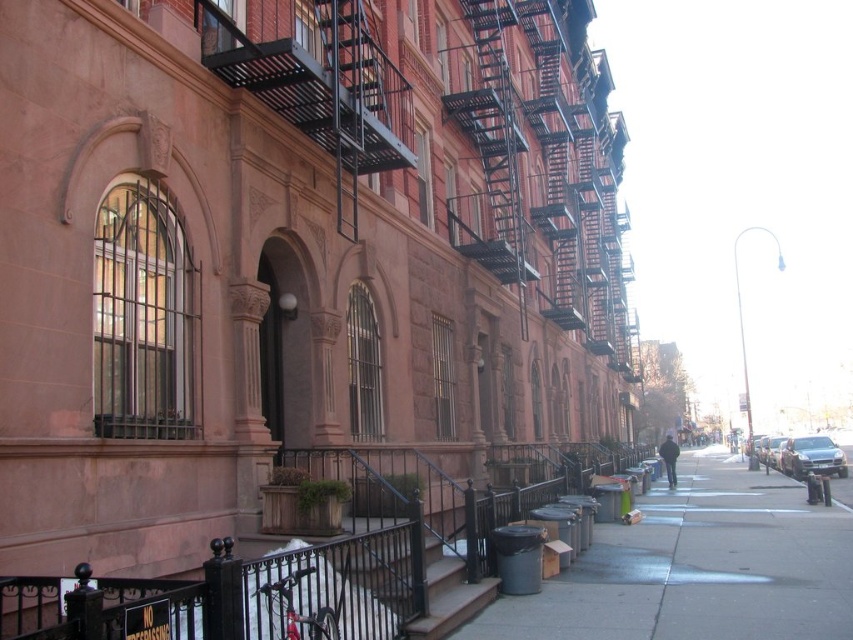
You are a delivery person with a 2.5 meter long box to deliver. You need to place it on the smooth concrete sidewalk at lower center or the shiny silver sedan at center right. Which location can fit the box without exceeding its size?

The smooth concrete sidewalk at lower center is bigger than the shiny silver sedan at center right, so the box can be placed on the smooth concrete sidewalk at lower center since it has enough space to accommodate the 2.5 meter long box.

You are standing on the sidewalk in front of the buildings and want to determine which of the two points, point (798, 544) or point (792, 451), is nearer to you. Based on the scene, which point is closer?

Point (798, 544) is closer to the viewer than point (792, 451).